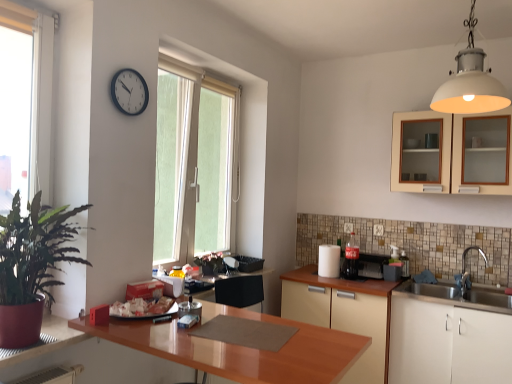
Question: Is white matte light fixture at upper right with green frosted glass window at center, which is counted as the 1th window, starting from the right?

Choices:
 (A) no
 (B) yes

Answer: (A)

Question: Can we say white matte light fixture at upper right lies outside green frosted glass window at center, arranged as the second window when viewed from the left?

Choices:
 (A) yes
 (B) no

Answer: (A)

Question: Is white matte light fixture at upper right shorter than green frosted glass window at center, which is the second window from front to back?

Choices:
 (A) no
 (B) yes

Answer: (B)

Question: Does white matte light fixture at upper right have a greater height compared to green frosted glass window at center, which is counted as the 1th window, starting from the right?

Choices:
 (A) yes
 (B) no

Answer: (B)

Question: Is white matte light fixture at upper right thinner than green frosted glass window at center, which is the second window from front to back?

Choices:
 (A) yes
 (B) no

Answer: (B)

Question: Would you say metallic silver toaster at right, which is counted as the 3th appliance, starting from the left, is inside or outside green leafy plant at left?

Choices:
 (A) outside
 (B) inside

Answer: (A)

Question: From the image's perspective, is metallic silver toaster at right, the first appliance when ordered from right to left, above or below green leafy plant at left?

Choices:
 (A) below
 (B) above

Answer: (A)

Question: Is metallic silver toaster at right, the first appliance when ordered from right to left, taller or shorter than green leafy plant at left?

Choices:
 (A) short
 (B) tall

Answer: (A)

Question: Is point (404, 274) positioned closer to the camera than point (44, 215)?

Choices:
 (A) closer
 (B) farther

Answer: (B)

Question: In terms of width, does clear glass soda bottle at center-right, which ranks as the second appliance in left-to-right order, look wider or thinner when compared to green frosted glass window at center, which is the second window from front to back?

Choices:
 (A) wide
 (B) thin

Answer: (A)

Question: From a real-world perspective, is clear glass soda bottle at center-right, which ranks as the second appliance in left-to-right order, above or below green frosted glass window at center, the first window from the back?

Choices:
 (A) below
 (B) above

Answer: (A)

Question: Choose the correct answer: Is clear glass soda bottle at center-right, which ranks as the 2th appliance in right-to-left order, inside green frosted glass window at center, arranged as the second window when viewed from the left, or outside it?

Choices:
 (A) inside
 (B) outside

Answer: (B)

Question: Is point (352, 266) positioned closer to the camera than point (205, 139)?

Choices:
 (A) farther
 (B) closer

Answer: (B)

Question: Looking at their shapes, would you say green leafy plant at left is wider or thinner than white paper towel at center, the first appliance when ordered from left to right?

Choices:
 (A) wide
 (B) thin

Answer: (A)

Question: Is point (47, 226) closer or farther from the camera than point (330, 244)?

Choices:
 (A) farther
 (B) closer

Answer: (B)